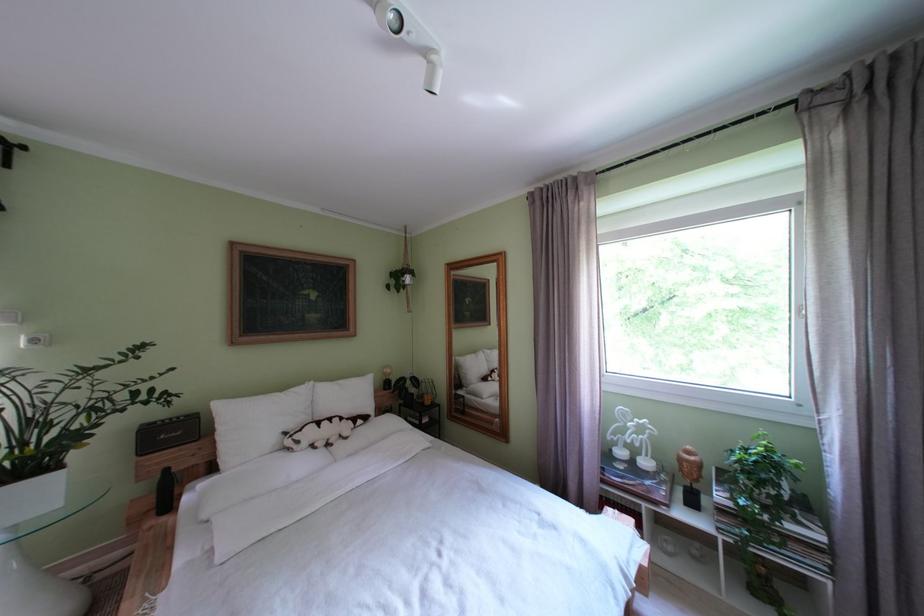
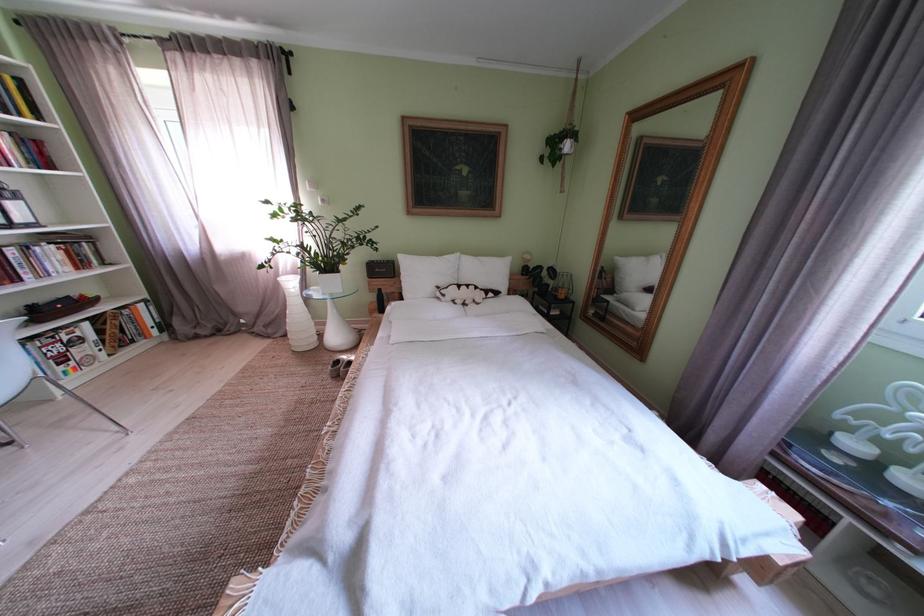
Locate, in the second image, the point that corresponds to point (351, 387) in the first image.

(492, 264)